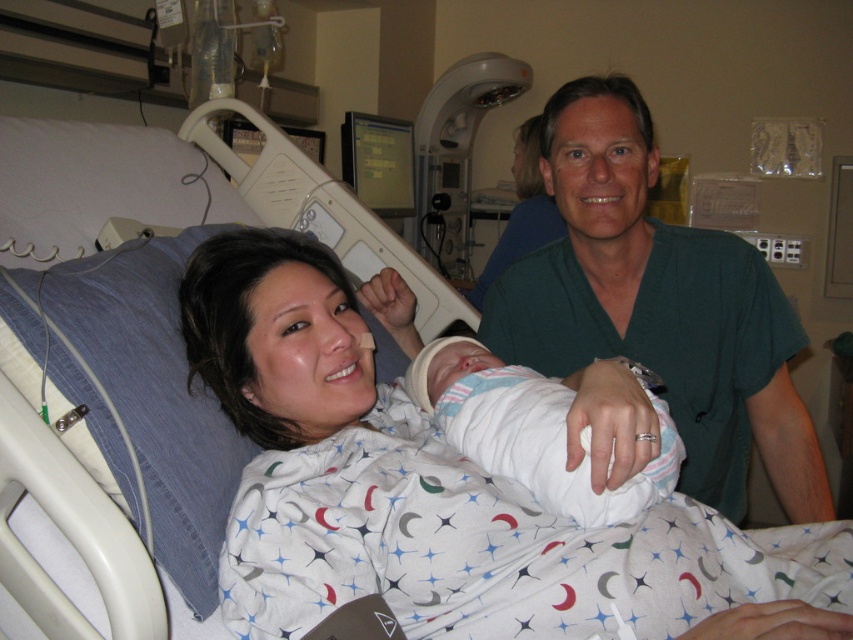
Question: Can you confirm if green scrubs at center is thinner than white swaddled newborn at center?

Choices:
 (A) yes
 (B) no

Answer: (B)

Question: Observing the image, what is the correct spatial positioning of green scrubs at center in reference to white swaddled newborn at center?

Choices:
 (A) right
 (B) left

Answer: (A)

Question: From the image, what is the correct spatial relationship of green scrubs at center in relation to white swaddled newborn at center?

Choices:
 (A) above
 (B) below

Answer: (A)

Question: Among these objects, which one is nearest to the camera?

Choices:
 (A) white swaddled newborn at center
 (B) green scrubs at center

Answer: (A)

Question: Which object appears closest to the camera in this image?

Choices:
 (A) white swaddled newborn at center
 (B) green scrubs at center

Answer: (A)